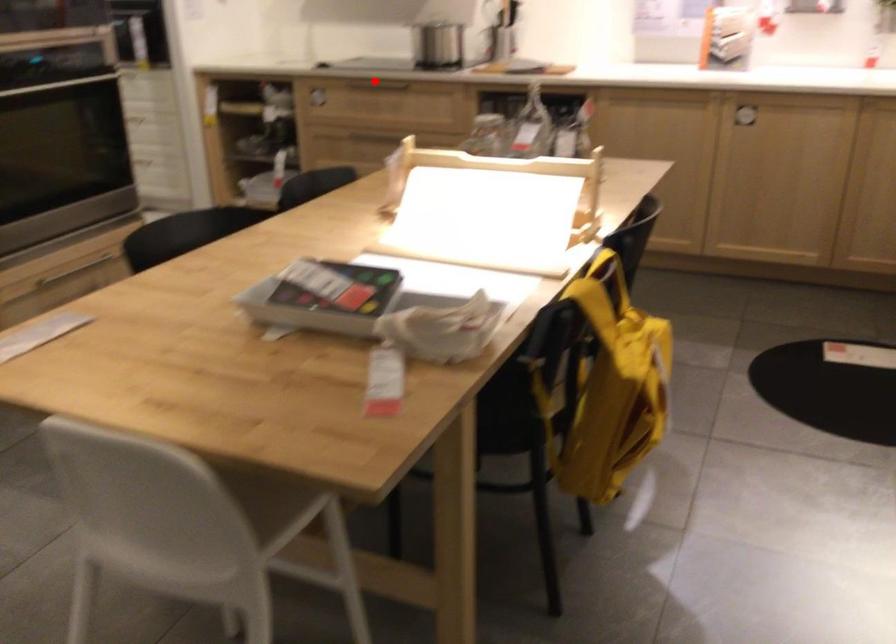
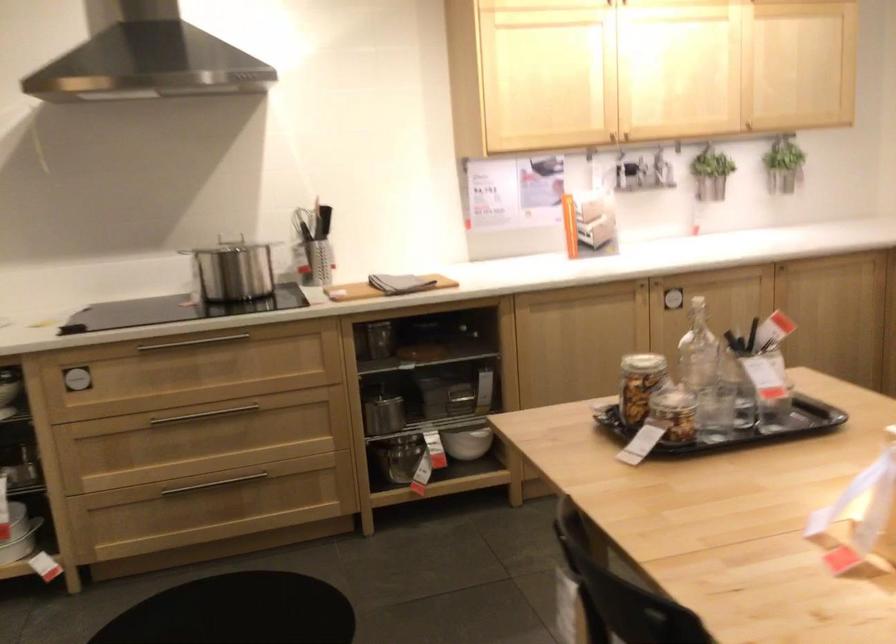
In the second image, find the point that corresponds to the highlighted location in the first image.

(194, 343)